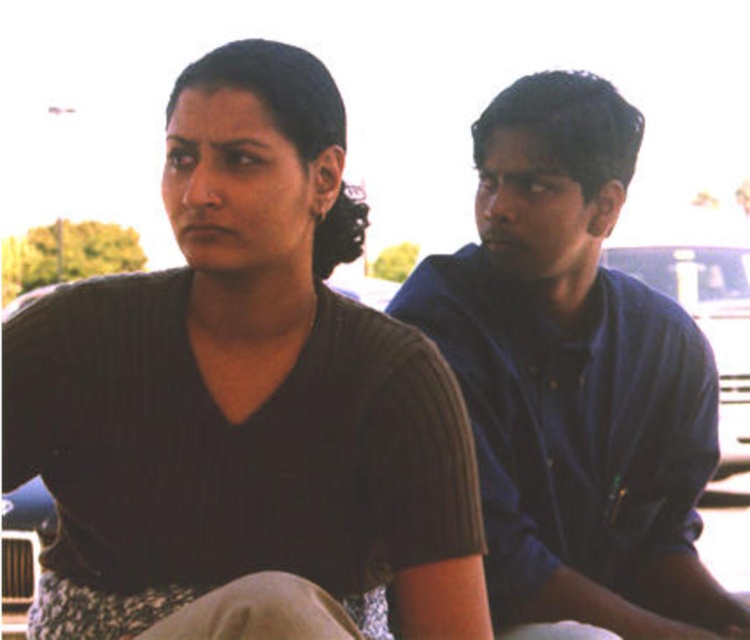
You are a photographer trying to capture both the matte brown shirt at center and the blue cotton shirt at right in a single frame. Since you want to ensure both shirts are clearly visible, which shirt should you focus on first to account for their sizes?

The matte brown shirt at center is bigger than the blue cotton shirt at right, so you should focus on the matte brown shirt at center first to ensure its details are sharp, then adjust for the smaller blue cotton shirt at right.

You are standing at the camera position and want to know how far the point at coordinates point (148, 355) is from you. Can you determine the distance in feet?

The distance of point (148, 355) from camera is 6.67 feet.

Please describe the location of the point at coordinates (244, 388) in relation to the individuals in the scene described. Use the provided scene description to support your answer.

The point at coordinates (244, 388) is located on the matte brown shirt at center, which belongs to the woman on the left wearing a dark brown V neck top. This placement aligns with her central positioning in the image as described in the scene.